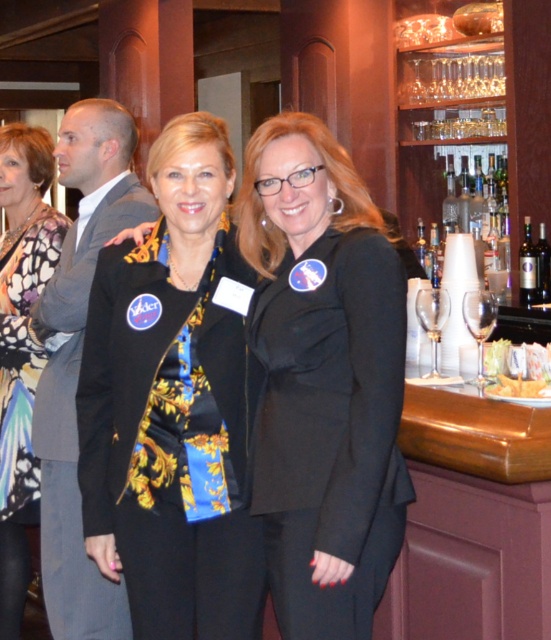
You are standing in front of the bar area and want to reach both points mentioned. Which point, point (298, 323) or point (94, 572), is closer to you?

Point (298, 323) is closer to the viewer than point (94, 572).

You are a photographer trying to capture the perfect shot of the black matte blazer at center. Given that the camera focuses on the center point of the image, which is at coordinate point 0.5, 0.5, will the blazer be in focus? Please explain your reasoning.

The black matte blazer at center is positioned at point (x=329, y=428), which is outside the center point of the image at (x=275, y=320). Therefore, the blazer will not be in focus if the camera is set to focus only on the exact center point.

You are a photographer setting up for a group photo. You need to arrange two people wearing the black satin blazer at center and the gray suit at left so that they appear balanced in height in the photo. Which person should you position closer to the camera?

The black satin blazer at center is not as tall as the gray suit at left, so you should position the person wearing the black satin blazer at center closer to the camera to balance their heights in the photo.